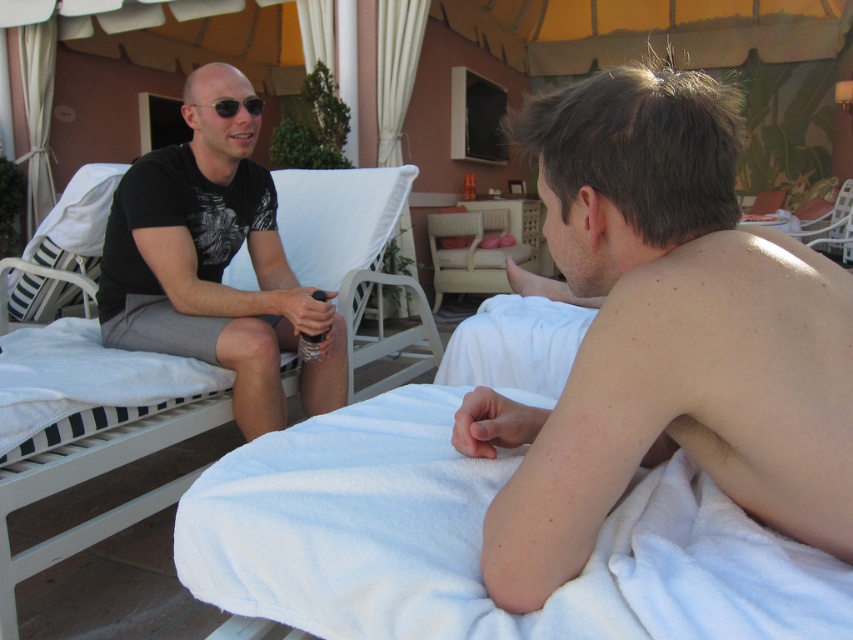
Can you confirm if beige fabric beach chair at center is positioned to the left of black matte sunglasses at left?

No, beige fabric beach chair at center is not to the left of black matte sunglasses at left.

Between beige fabric beach chair at center and black matte sunglasses at left, which one is positioned lower?

black matte sunglasses at left is below.

Is point (485, 253) closer to camera compared to point (260, 106)?

That is False.

What are the coordinates of `beige fabric beach chair at center` in the screenshot? It's located at (485, 248).

Is smooth skin torso at right thinner than black matte t-shirt at left?

Indeed, smooth skin torso at right has a lesser width compared to black matte t-shirt at left.

Who is positioned more to the right, smooth skin torso at right or black matte t-shirt at left?

smooth skin torso at right is more to the right.

Between point (602, 324) and point (177, 209), which one is positioned in front?

Positioned in front is point (602, 324).

In order to click on smooth skin torso at right in this screenshot , I will do `click(664, 333)`.

Is black matte t-shirt at left above beige fabric beach chair at center?

No, black matte t-shirt at left is not above beige fabric beach chair at center.

The width and height of the screenshot is (853, 640). In order to click on black matte t-shirt at left in this screenshot , I will do `click(213, 262)`.